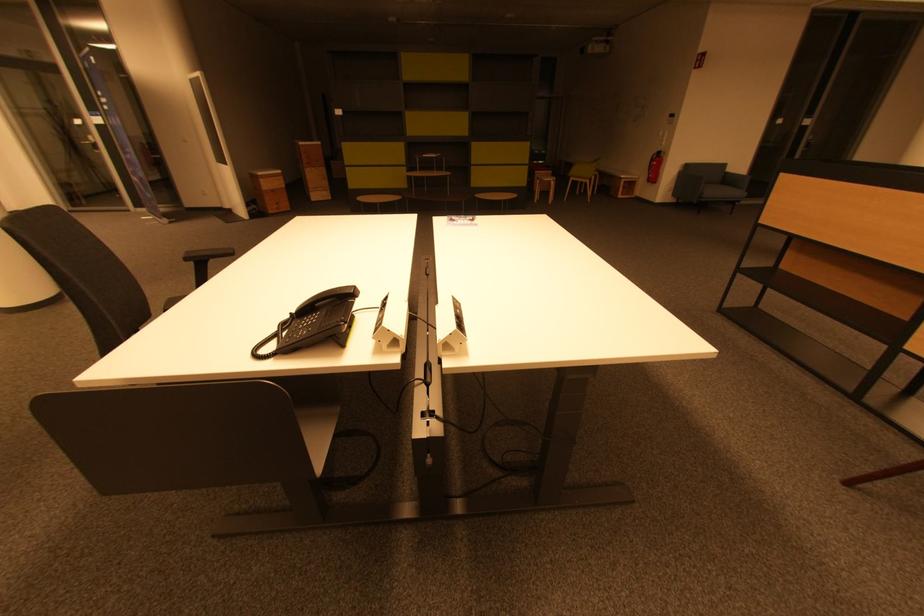
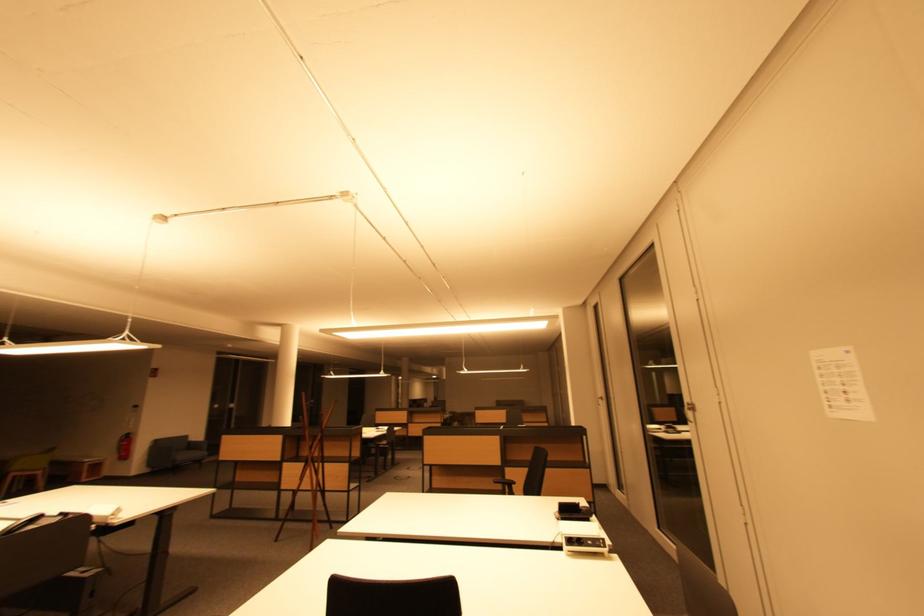
The point at (x=719, y=195) is marked in the first image. Where is the corresponding point in the second image?

(188, 458)